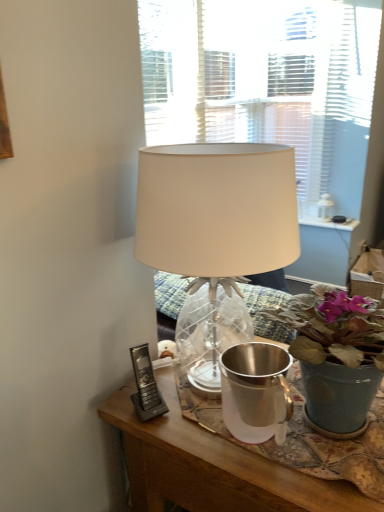
Question: From the image's perspective, would you say black plastic phone at lower left is shown under white fabric lampshade at center?

Choices:
 (A) yes
 (B) no

Answer: (A)

Question: Does black plastic phone at lower left have a lesser width compared to white fabric lampshade at center?

Choices:
 (A) yes
 (B) no

Answer: (A)

Question: Considering the relative sizes of black plastic phone at lower left and white fabric lampshade at center in the image provided, is black plastic phone at lower left wider than white fabric lampshade at center?

Choices:
 (A) no
 (B) yes

Answer: (A)

Question: Is black plastic phone at lower left positioned before white fabric lampshade at center?

Choices:
 (A) yes
 (B) no

Answer: (B)

Question: From a real-world perspective, is black plastic phone at lower left physically above white fabric lampshade at center?

Choices:
 (A) yes
 (B) no

Answer: (B)

Question: Considering the positions of silver metallic watering can at center and matte gray pot at center in the image, is silver metallic watering can at center wider or thinner than matte gray pot at center?

Choices:
 (A) thin
 (B) wide

Answer: (A)

Question: Would you say silver metallic watering can at center is inside or outside matte gray pot at center?

Choices:
 (A) inside
 (B) outside

Answer: (A)

Question: From a real-world perspective, is silver metallic watering can at center above or below matte gray pot at center?

Choices:
 (A) below
 (B) above

Answer: (A)

Question: Considering their positions, is silver metallic watering can at center located in front of or behind matte gray pot at center?

Choices:
 (A) behind
 (B) front

Answer: (A)

Question: From the image's perspective, is white fabric lampshade at center above or below matte gray pot at center?

Choices:
 (A) below
 (B) above

Answer: (B)

Question: Which is correct: white fabric lampshade at center is inside matte gray pot at center, or outside of it?

Choices:
 (A) inside
 (B) outside

Answer: (B)

Question: Considering the relative positions of white fabric lampshade at center and matte gray pot at center in the image provided, is white fabric lampshade at center to the left or to the right of matte gray pot at center?

Choices:
 (A) left
 (B) right

Answer: (A)

Question: Is white fabric lampshade at center wider or thinner than matte gray pot at center?

Choices:
 (A) thin
 (B) wide

Answer: (B)

Question: From the image's perspective, is black plastic phone at lower left above or below silver metallic watering can at center?

Choices:
 (A) below
 (B) above

Answer: (B)

Question: Considering the positions of point (148, 370) and point (274, 369), is point (148, 370) closer or farther from the camera than point (274, 369)?

Choices:
 (A) closer
 (B) farther

Answer: (B)